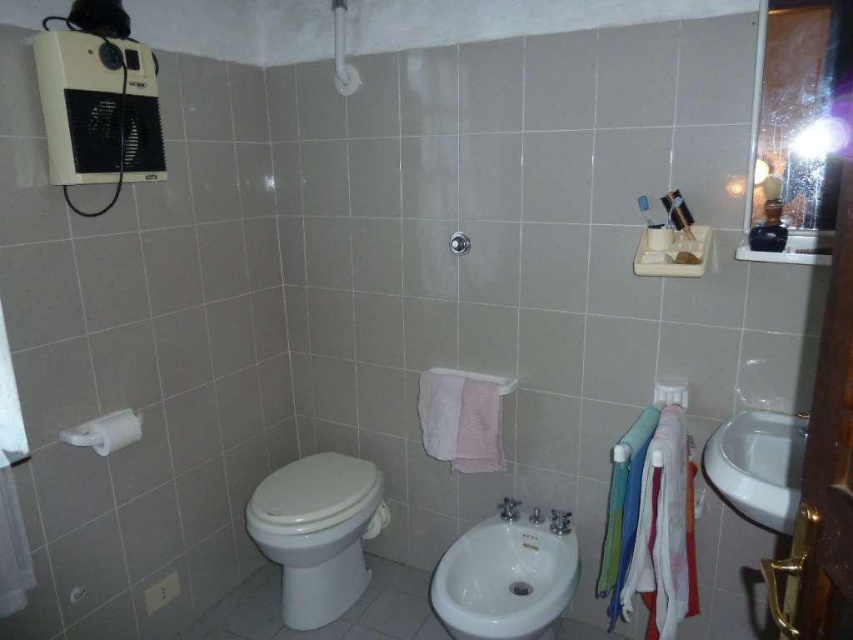
Does white glossy bidet at center lie behind black plastic toothbrush at upper right?

No.

Does point (525, 520) come closer to viewer compared to point (666, 200)?

No, it is behind (666, 200).

The width and height of the screenshot is (853, 640). I want to click on white glossy bidet at center, so click(x=505, y=577).

What are the coordinates of `white glossy bidet at center` in the screenshot? It's located at (505, 577).

Between point (787, 461) and point (682, 225), which one is positioned in front?

Point (787, 461) is more forward.

Does white glossy sink at right have a smaller size compared to black plastic toothbrush at upper right?

Incorrect, white glossy sink at right is not smaller in size than black plastic toothbrush at upper right.

Find the location of a particular element. This screenshot has width=853, height=640. white glossy sink at right is located at coordinates (757, 465).

Identify the location of white glossy sink at right. (757, 465).

Is point (310, 500) positioned behind point (453, 241)?

Yes, it is behind point (453, 241).

Who is taller, white glossy toilet at center or matte silver shower at upper center?

white glossy toilet at center

Who is more forward, (355,499) or (467,236)?

Answer: Point (467,236) is more forward.

The image size is (853, 640). I want to click on white glossy toilet at center, so click(x=317, y=532).